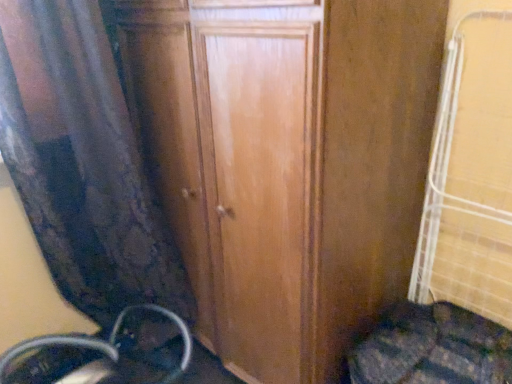
Question: Is wooden door at center to the left or to the right of metallic silver wheel at lower left in the image?

Choices:
 (A) right
 (B) left

Answer: (A)

Question: Considering their positions, is wooden door at center located in front of or behind metallic silver wheel at lower left?

Choices:
 (A) behind
 (B) front

Answer: (B)

Question: Estimate the real-world distances between objects in this image. Which object is closer to the wooden door at center?

Choices:
 (A) velvet curtain at left
 (B) metallic silver wheel at lower left

Answer: (A)

Question: Which of these objects is positioned farthest from the velvet curtain at left?

Choices:
 (A) metallic silver wheel at lower left
 (B) wooden door at center

Answer: (A)